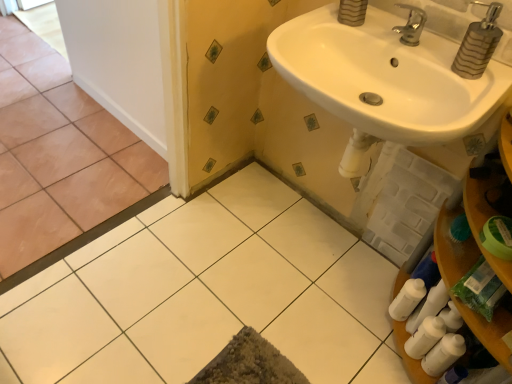
The width and height of the screenshot is (512, 384). I want to click on vacant space to the right of silver metallic faucet at upper right, so click(437, 55).